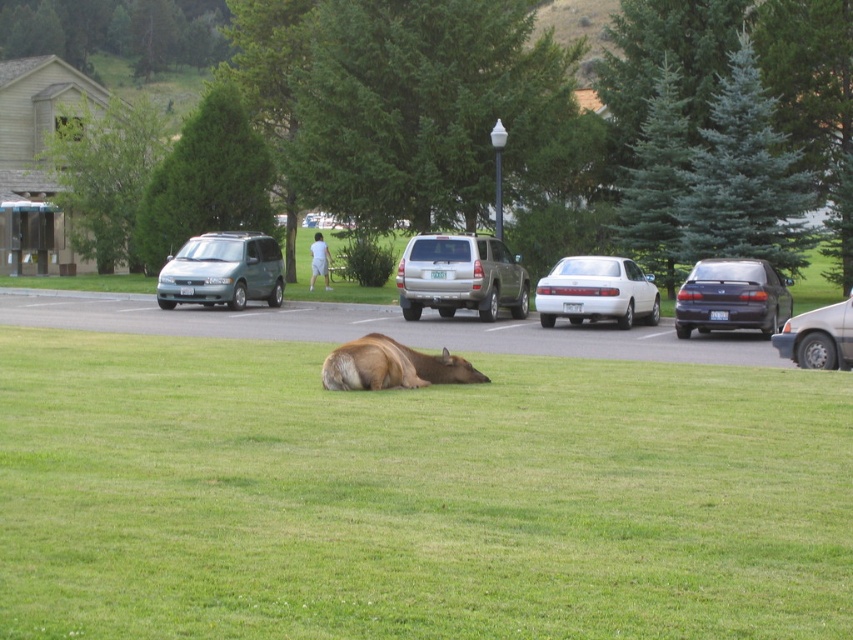
Does green grass at center have a lesser width compared to silver metallic sedan at right?

In fact, green grass at center might be wider than silver metallic sedan at right.

Between point (561, 465) and point (792, 348), which one is positioned in front?

Positioned in front is point (561, 465).

This screenshot has width=853, height=640. What are the coordinates of `green grass at center` in the screenshot? It's located at (415, 497).

Is gold metallic suv at center behind brown furry deer at center?

That is True.

Between point (523, 291) and point (354, 348), which one is positioned in front?

Point (354, 348) is more forward.

The width and height of the screenshot is (853, 640). In order to click on gold metallic suv at center in this screenshot , I will do `click(460, 276)`.

This screenshot has height=640, width=853. I want to click on gold metallic suv at center, so click(x=460, y=276).

Does brown furry deer at center have a larger size compared to silver metallic sedan at right?

No, brown furry deer at center is not bigger than silver metallic sedan at right.

Can you confirm if brown furry deer at center is wider than silver metallic sedan at right?

No.

Is point (386, 364) positioned behind point (822, 332)?

That is False.

Where is `brown furry deer at center`? The image size is (853, 640). brown furry deer at center is located at coordinates (392, 365).